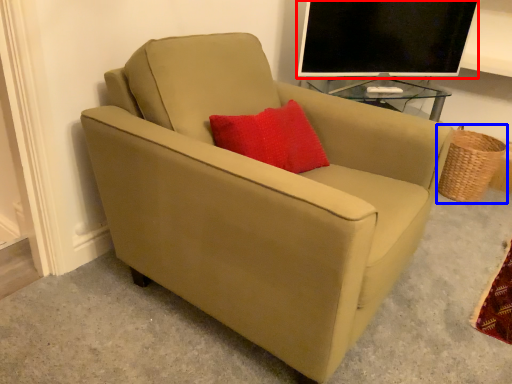
Question: Which of the following is the closest to the observer, television (highlighted by a red box) or basket (highlighted by a blue box)?

Choices:
 (A) television
 (B) basket

Answer: (A)